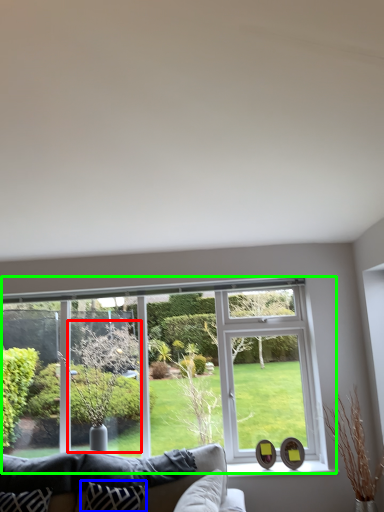
Question: Which object is the closest to the tree (highlighted by a red box)? Choose among these: pillow (highlighted by a blue box) or window (highlighted by a green box).

Choices:
 (A) pillow
 (B) window

Answer: (B)